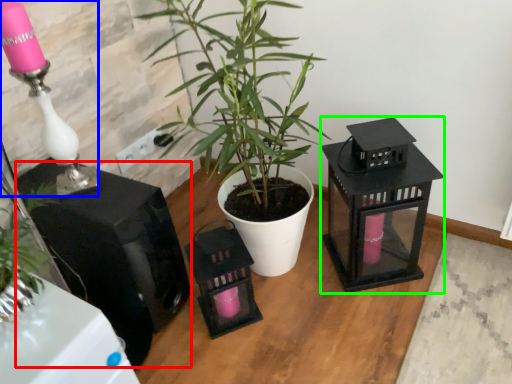
Question: Which is nearer to the appliance (highlighted by a red box)? table lamp (highlighted by a blue box) or appliance (highlighted by a green box).

Choices:
 (A) table lamp
 (B) appliance

Answer: (A)